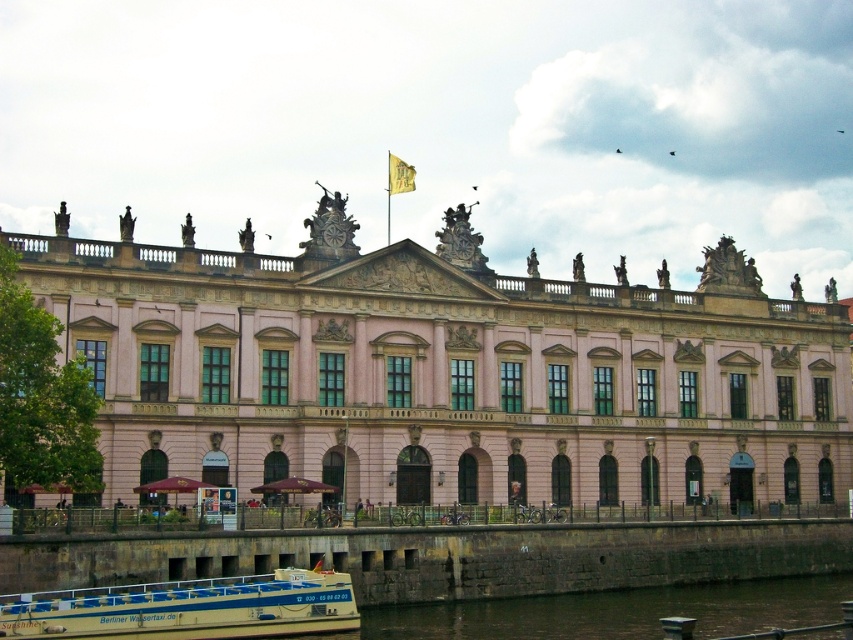
Can you confirm if dark stone wall at lower center is taller than white plastic boat at lower left?

Correct, dark stone wall at lower center is much taller as white plastic boat at lower left.

Does dark stone wall at lower center have a larger size compared to white plastic boat at lower left?

Yes.

The image size is (853, 640). I want to click on dark stone wall at lower center, so click(x=621, y=611).

Can you confirm if pink stone building at center is thinner than yellow fabric flag at upper center?

No, pink stone building at center is not thinner than yellow fabric flag at upper center.

Who is more forward, [700,419] or [405,177]?

Point [405,177]

What are the coordinates of `pink stone building at center` in the screenshot? It's located at (447, 371).

Is point (73, 294) positioned behind point (456, 630)?

No, (73, 294) is in front of (456, 630).

How distant is pink stone building at center from dark stone wall at lower center?

pink stone building at center is 15.40 meters from dark stone wall at lower center.

Who is more forward, (x=659, y=356) or (x=399, y=630)?

Point (x=399, y=630) is more forward.

This screenshot has height=640, width=853. I want to click on pink stone building at center, so click(x=447, y=371).